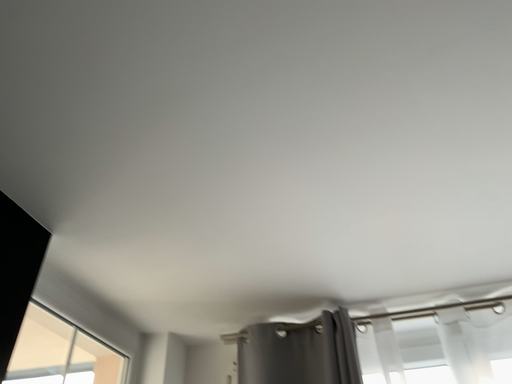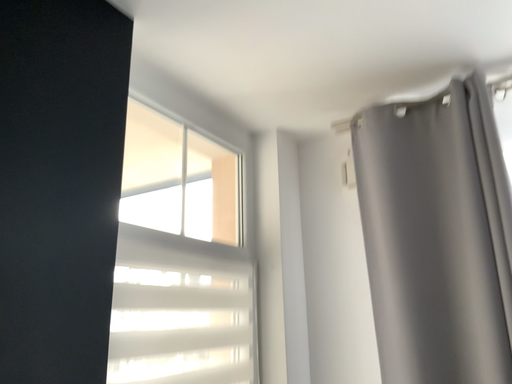
Question: How did the camera likely rotate when shooting the video?

Choices:
 (A) rotated left
 (B) rotated right

Answer: (A)